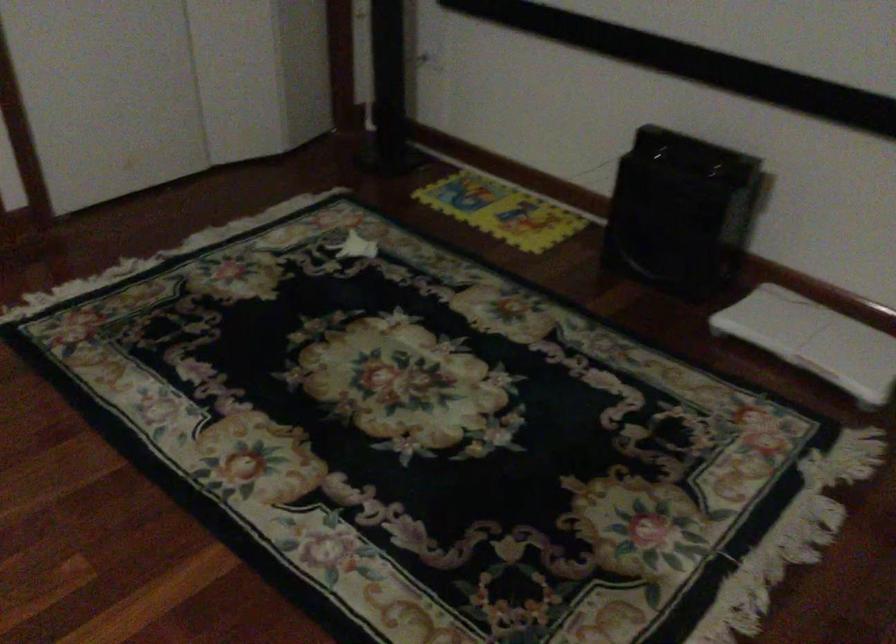
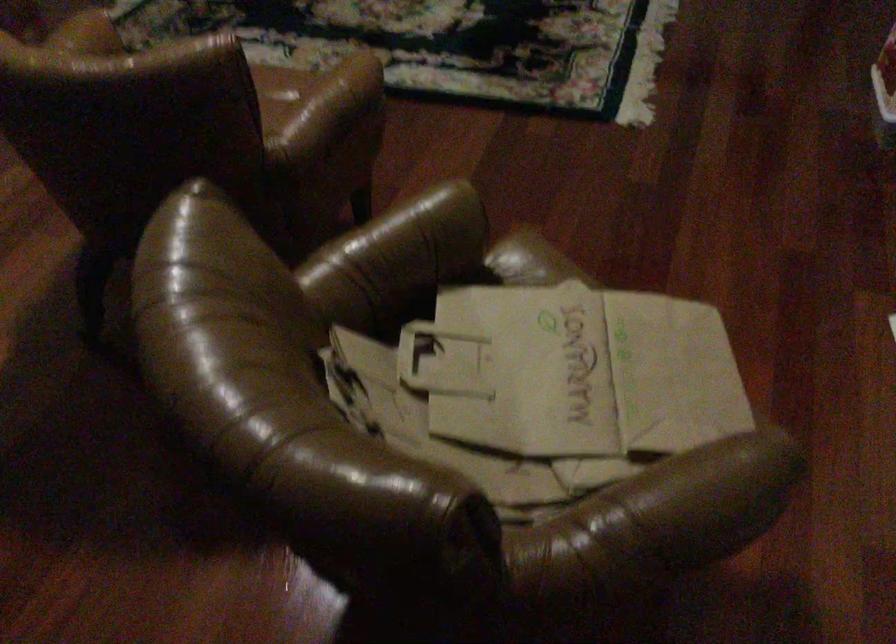
What movement of the cameraman would produce the second image?

The movement direction of the cameraman is left, backward.